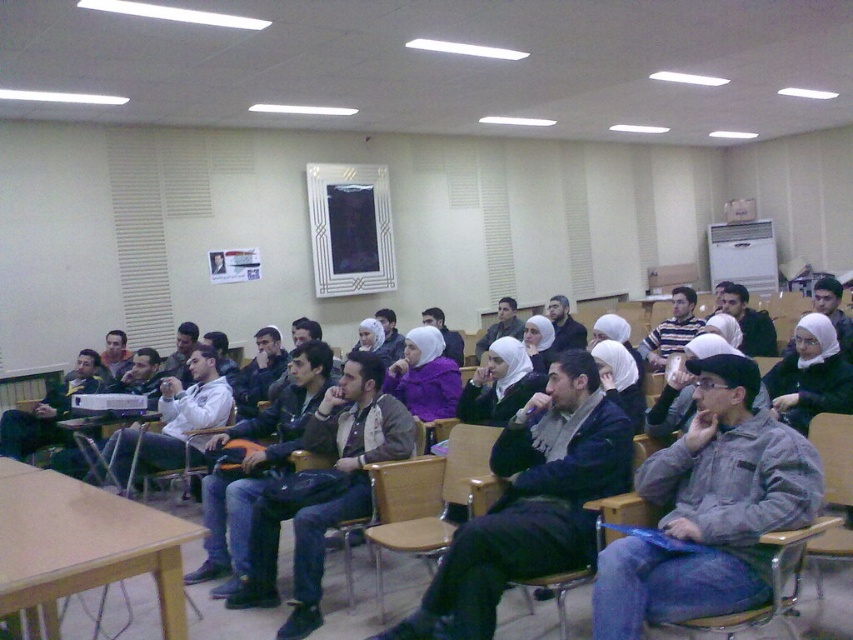
Consider the image. Who is lower down, gray fuzzy jacket at center or dark gray jacket at center?

dark gray jacket at center is below.

Does gray fuzzy jacket at center lie in front of dark gray jacket at center?

Yes, gray fuzzy jacket at center is closer to the viewer.

Is point (666, 595) farther from viewer compared to point (398, 420)?

No, (666, 595) is in front of (398, 420).

The height and width of the screenshot is (640, 853). Find the location of `gray fuzzy jacket at center`. gray fuzzy jacket at center is located at coordinates (709, 509).

Does gray fuzzy jacket at center have a lesser width compared to dark gray sweater at center?

Indeed, gray fuzzy jacket at center has a lesser width compared to dark gray sweater at center.

Which is in front, point (653, 483) or point (579, 508)?

Point (653, 483)

Locate an element on the screen. The width and height of the screenshot is (853, 640). gray fuzzy jacket at center is located at coordinates (709, 509).

Between dark gray jacket at center and wooden at center, which one is positioned lower?

wooden at center is below.

What do you see at coordinates (323, 490) in the screenshot? I see `dark gray jacket at center` at bounding box center [323, 490].

Identify the location of dark gray jacket at center. Image resolution: width=853 pixels, height=640 pixels. (323, 490).